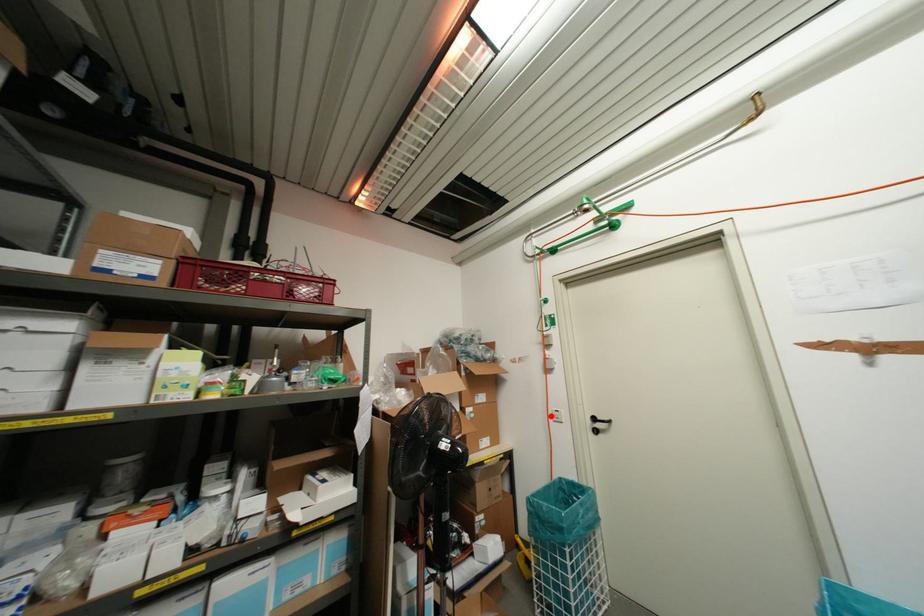
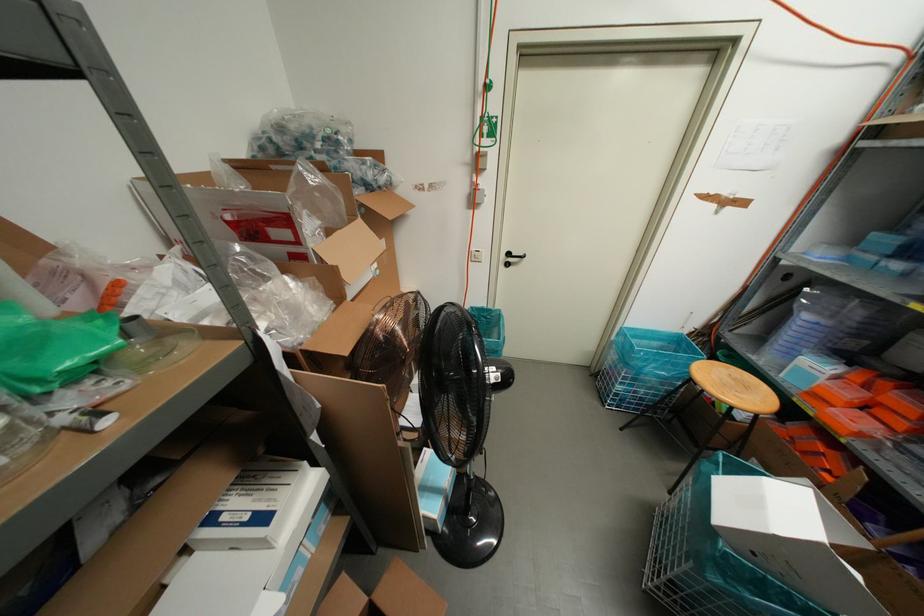
Find the pixel in the second image that matches the highlighted location in the first image.

(470, 257)